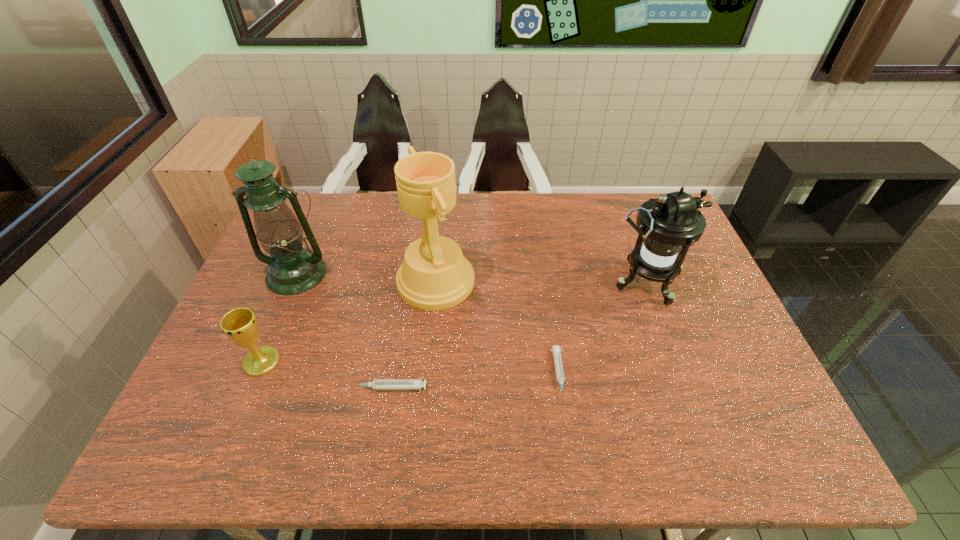
Considering the uniform spacing of syringes, where should an additional syringe be positioned on the right? Please locate a free spot. Please provide its 2D coordinates. Your answer should be formatted as a tuple, i.e. [(x, y)], where the tuple contains the x and y coordinates of a point satisfying the conditions above.

[(724, 363)]